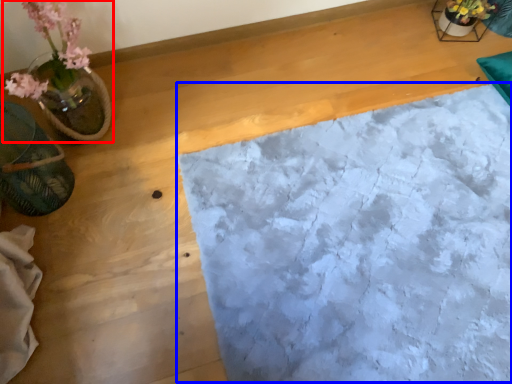
Question: Which object appears farthest to the camera in this image, houseplant (highlighted by a red box) or sheet (highlighted by a blue box)?

Choices:
 (A) houseplant
 (B) sheet

Answer: (B)